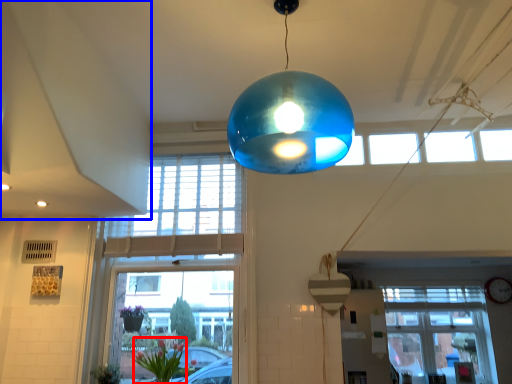
Question: Among these objects, which one is nearest to the camera, floral arrangement (highlighted by a red box) or exhaust hood (highlighted by a blue box)?

Choices:
 (A) floral arrangement
 (B) exhaust hood

Answer: (B)